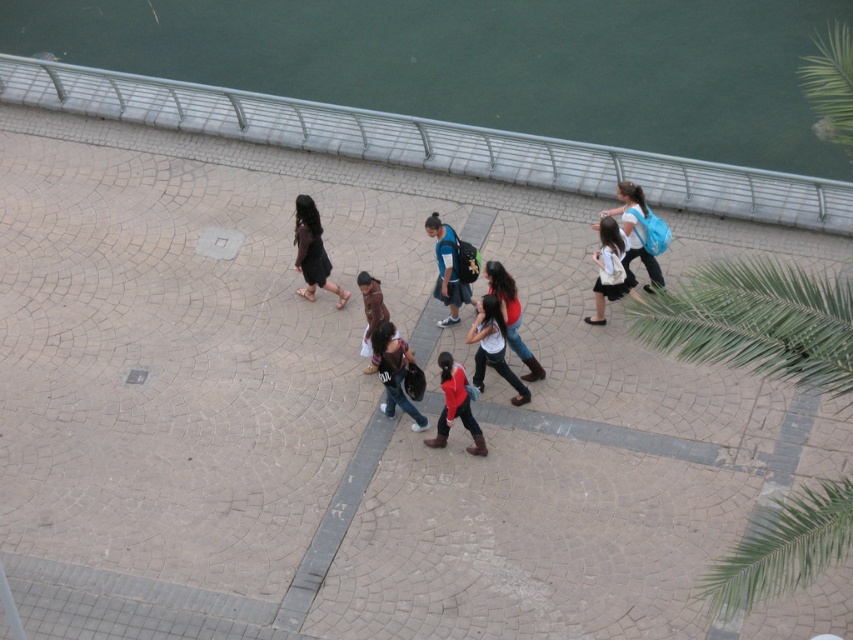
Question: Considering the relative positions of white fabric skirt at center and brown leather jacket at center in the image provided, where is white fabric skirt at center located with respect to brown leather jacket at center?

Choices:
 (A) below
 (B) above

Answer: (B)

Question: Is red matte jacket at center bigger than brown leather jacket at center?

Choices:
 (A) no
 (B) yes

Answer: (B)

Question: Among these points, which one is nearest to the camera?

Choices:
 (A) (379, 307)
 (B) (461, 385)
 (C) (622, 284)

Answer: (B)

Question: Which point is farther to the camera?

Choices:
 (A) (453, 284)
 (B) (312, 284)
 (C) (360, 275)
 (D) (616, 209)

Answer: (B)

Question: Among these points, which one is farthest from the camera?

Choices:
 (A) (515, 316)
 (B) (381, 372)
 (C) (477, 340)

Answer: (A)

Question: Is dark brown leather skirt at center above white fabric skirt at center?

Choices:
 (A) no
 (B) yes

Answer: (B)